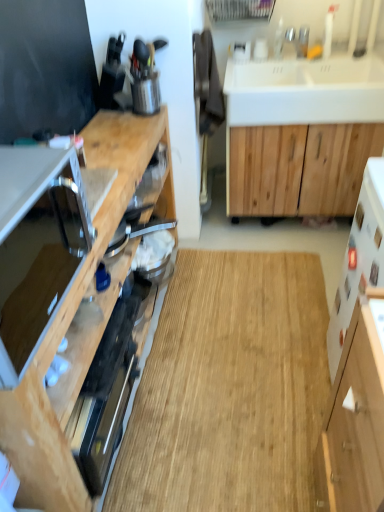
Question: Considering the relative sizes of white matte cabinet at lower right, which is counted as the second cabinetry, starting from the right, and natural wood cabinet at center, acting as the 1th cabinetry starting from the right, in the image provided, is white matte cabinet at lower right, which is counted as the second cabinetry, starting from the right, thinner than natural wood cabinet at center, acting as the 1th cabinetry starting from the right,?

Choices:
 (A) no
 (B) yes

Answer: (B)

Question: Is white matte cabinet at lower right, the 2th cabinetry from the left, smaller than natural wood cabinet at center, acting as the 1th cabinetry starting from the right?

Choices:
 (A) no
 (B) yes

Answer: (B)

Question: From the image's perspective, would you say white matte cabinet at lower right, the 2th cabinetry from the left, is positioned over natural wood cabinet at center, acting as the 1th cabinetry starting from the right?

Choices:
 (A) yes
 (B) no

Answer: (B)

Question: Does white matte cabinet at lower right, which is counted as the second cabinetry, starting from the right, lie in front of natural wood cabinet at center, acting as the 1th cabinetry starting from the right?

Choices:
 (A) no
 (B) yes

Answer: (B)

Question: From a real-world perspective, is white matte cabinet at lower right, which is counted as the second cabinetry, starting from the right, positioned under natural wood cabinet at center, the 3th cabinetry from the left, based on gravity?

Choices:
 (A) yes
 (B) no

Answer: (B)

Question: From a real-world perspective, is natural wood cabinet at center, acting as the 1th cabinetry starting from the right, physically located above or below white matte cabinet at lower right, which is counted as the second cabinetry, starting from the right?

Choices:
 (A) below
 (B) above

Answer: (A)

Question: Is point (271, 168) closer or farther from the camera than point (344, 495)?

Choices:
 (A) farther
 (B) closer

Answer: (A)

Question: From the image's perspective, relative to white matte cabinet at lower right, the 2th cabinetry from the left, is natural wood cabinet at center, the 3th cabinetry from the left, above or below?

Choices:
 (A) above
 (B) below

Answer: (A)

Question: Looking at the image, does natural wood cabinet at center, the 3th cabinetry from the left, seem bigger or smaller compared to white matte cabinet at lower right, which is counted as the second cabinetry, starting from the right?

Choices:
 (A) big
 (B) small

Answer: (A)

Question: Is wooden cabinet at left, acting as the 3th cabinetry starting from the right, bigger or smaller than white glossy sink at upper right?

Choices:
 (A) small
 (B) big

Answer: (B)

Question: Is wooden cabinet at left, the 1th cabinetry viewed from the left, wider or thinner than white glossy sink at upper right?

Choices:
 (A) wide
 (B) thin

Answer: (B)

Question: Considering the positions of point (18, 155) and point (311, 96), is point (18, 155) closer or farther from the camera than point (311, 96)?

Choices:
 (A) closer
 (B) farther

Answer: (A)

Question: Considering the relative positions of wooden cabinet at left, acting as the 3th cabinetry starting from the right, and white glossy sink at upper right in the image provided, is wooden cabinet at left, acting as the 3th cabinetry starting from the right, to the left or to the right of white glossy sink at upper right?

Choices:
 (A) right
 (B) left

Answer: (B)

Question: From the image's perspective, is white glossy sink at upper right above or below satin silver microwave at left, the 2th appliance positioned from the back?

Choices:
 (A) above
 (B) below

Answer: (A)

Question: From a real-world perspective, relative to satin silver microwave at left, arranged as the first appliance when viewed from the front, is white glossy sink at upper right vertically above or below?

Choices:
 (A) below
 (B) above

Answer: (A)